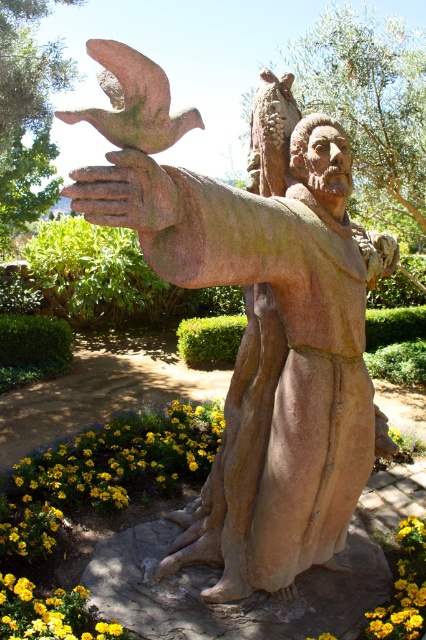
Is point (5, 636) less distant than point (403, 627)?

That is True.

Can you confirm if yellow matte flower at lower left is smaller than yellow/yellowish-green petals at lower right?

Correct, yellow matte flower at lower left occupies less space than yellow/yellowish-green petals at lower right.

Find the location of a particular element. Image resolution: width=426 pixels, height=640 pixels. yellow matte flower at lower left is located at coordinates (48, 612).

Is yellowfloralflower at lower left closer to camera compared to rustic stone hand at center?

No, yellowfloralflower at lower left is further to the viewer.

I want to click on yellowfloralflower at lower left, so 104,472.

Which is in front, point (218, 429) or point (146, 224)?

Positioned in front is point (146, 224).

Locate an element on the screen. Image resolution: width=426 pixels, height=640 pixels. yellowfloralflower at lower left is located at coordinates (104, 472).

Which is below, bronze statue at center or yellowfloralflower at lower left?

yellowfloralflower at lower left is below.

From the picture: Measure the distance between bronze statue at center and camera.

bronze statue at center and camera are 4.80 feet apart from each other.

Between point (232, 576) and point (155, 445), which one is positioned in front?

Positioned in front is point (232, 576).

The image size is (426, 640). I want to click on bronze statue at center, so click(x=256, y=316).